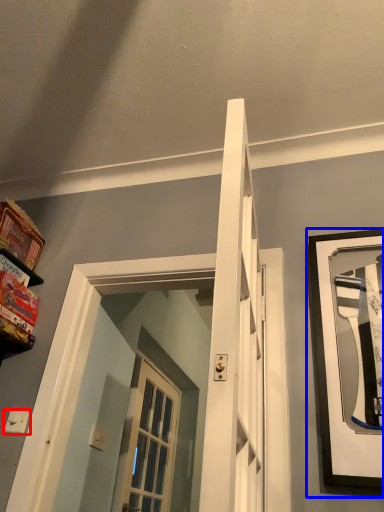
Question: Which object appears farthest to the camera in this image, light switch (highlighted by a red box) or picture frame (highlighted by a blue box)?

Choices:
 (A) light switch
 (B) picture frame

Answer: (A)